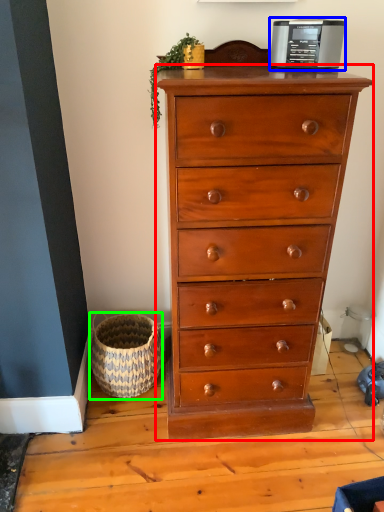
Question: Based on their relative distances, which object is farther from chest of drawers (highlighted by a red box)? Choose from appliance (highlighted by a blue box) and basket (highlighted by a green box).

Choices:
 (A) appliance
 (B) basket

Answer: (A)